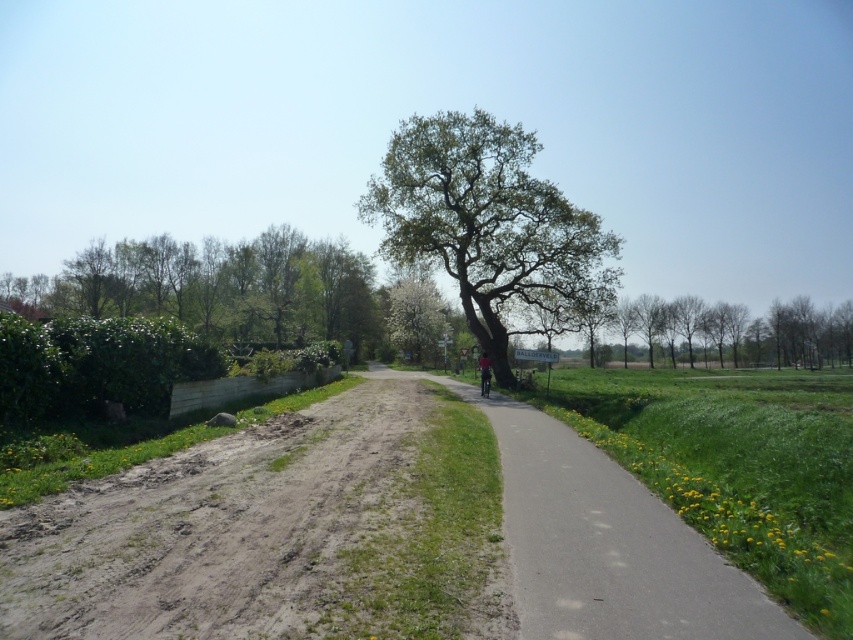
The width and height of the screenshot is (853, 640). Describe the element at coordinates (212, 528) in the screenshot. I see `brown dirt track at lower left` at that location.

Does brown dirt track at lower left appear under green leafy tree at center?

Yes, brown dirt track at lower left is below green leafy tree at center.

Locate an element on the screen. The width and height of the screenshot is (853, 640). brown dirt track at lower left is located at coordinates (212, 528).

What are the coordinates of `brown dirt track at lower left` in the screenshot? It's located at (212, 528).

Who is more distant from viewer, (711, 314) or (485, 394)?

Positioned behind is point (711, 314).

Consider the image. Is bare branches at right to the left of dark red fabric cyclist at center from the viewer's perspective?

No, bare branches at right is not to the left of dark red fabric cyclist at center.

Is point (717, 348) closer to viewer compared to point (485, 376)?

No, (717, 348) is behind (485, 376).

I want to click on bare branches at right, so click(x=781, y=333).

Between brown dirt track at lower left and bare branches at right, which one has more height?

With more height is bare branches at right.

Can you confirm if brown dirt track at lower left is positioned to the left of bare branches at right?

Indeed, brown dirt track at lower left is positioned on the left side of bare branches at right.

At what (x,y) coordinates should I click in order to perform the action: click on brown dirt track at lower left. Please return your answer as a coordinate pair (x, y). The image size is (853, 640). Looking at the image, I should click on (212, 528).